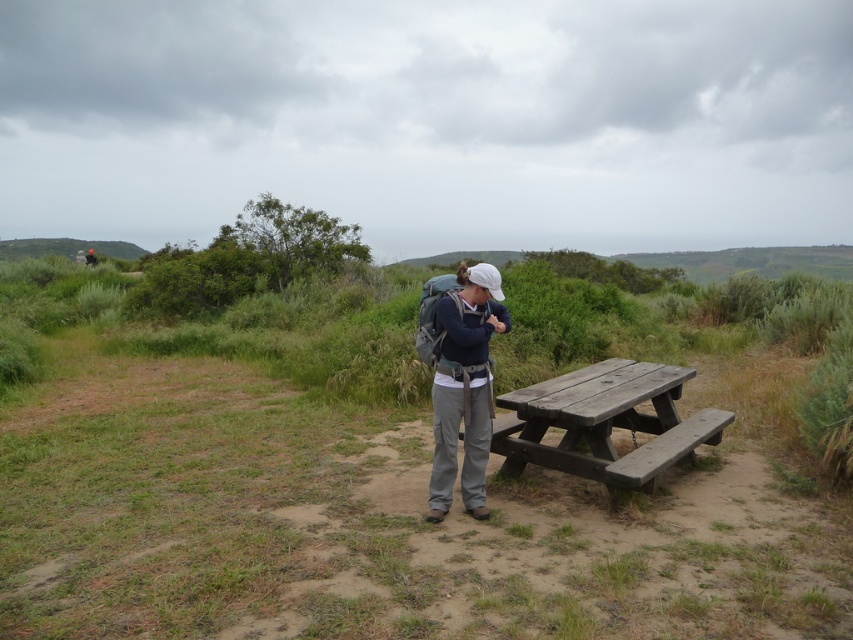
You are standing at the edge of the picnic area and want to place your backpack on the ground next to the weathered wood picnic table at center and the matte gray backpack at center. Which side of the picnic table should you choose to ensure your backpack is not blocking the benches?

The weathered wood picnic table at center is to the right of the matte gray backpack at center, so placing your backpack to the left side of the picnic table would keep it away from the benches and prevent blocking.